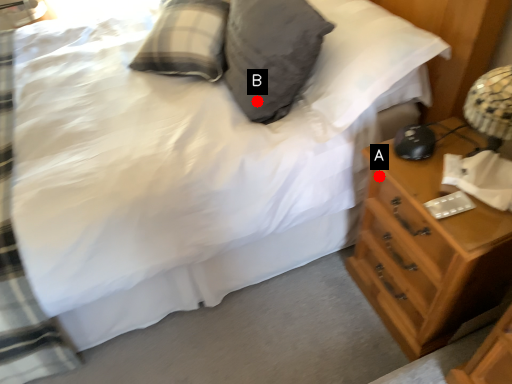
Question: Two points are circled on the image, labeled by A and B beside each circle. Among these points, which one is farthest from the camera?

Choices:
 (A) A is further
 (B) B is further

Answer: (B)